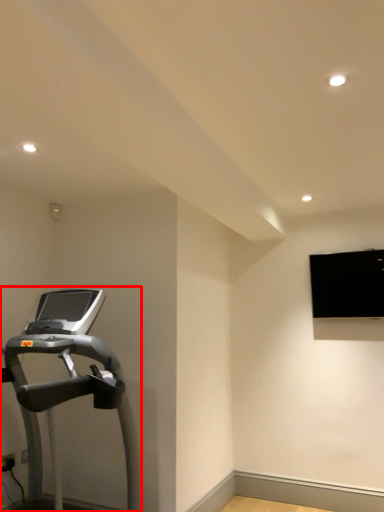
Question: From the image's perspective, where is treadmill (annotated by the red box) located relative to projection screen?

Choices:
 (A) above
 (B) below

Answer: (B)